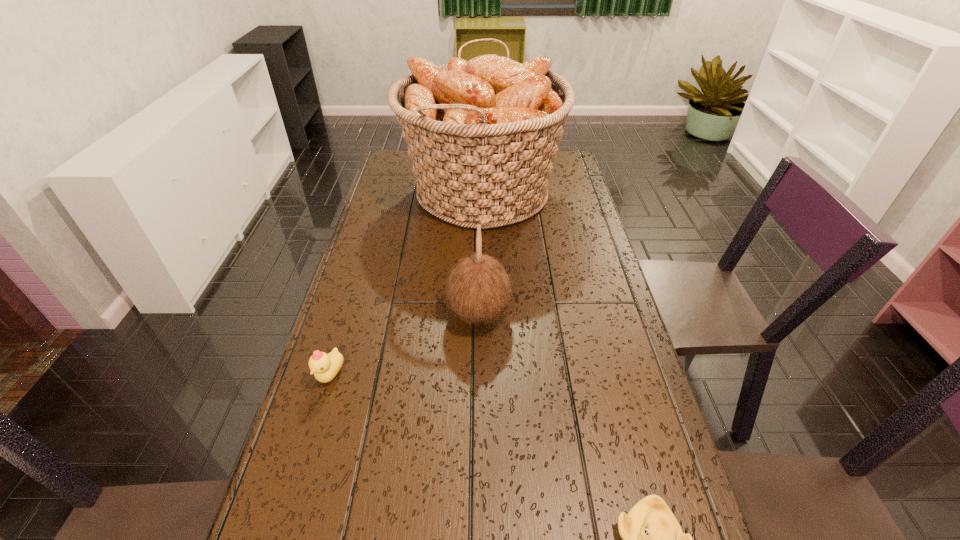
Identify the location of basket situated at the left edge. The width and height of the screenshot is (960, 540). (x=483, y=134).

Identify the location of duckling that is positioned at the left edge. The height and width of the screenshot is (540, 960). (325, 367).

Find the location of a particular element. This screenshot has width=960, height=540. object situated at the right edge is located at coordinates (483, 134).

I want to click on object that is positioned at the far left corner, so click(x=483, y=134).

Find the location of `object that is at the far right corner`. object that is at the far right corner is located at coordinates (483, 134).

Find the location of a particular element. free region at the left edge is located at coordinates (379, 312).

In order to click on free space at the right edge of the desktop in this screenshot , I will do `click(584, 264)`.

Identify the location of vacant space at the far left corner of the desktop. Image resolution: width=960 pixels, height=540 pixels. (385, 166).

This screenshot has height=540, width=960. In order to click on free space at the far right corner of the desktop in this screenshot , I will do `click(572, 176)`.

Where is `free point between the farther duckling and the second farthest object`? The height and width of the screenshot is (540, 960). free point between the farther duckling and the second farthest object is located at coordinates (405, 344).